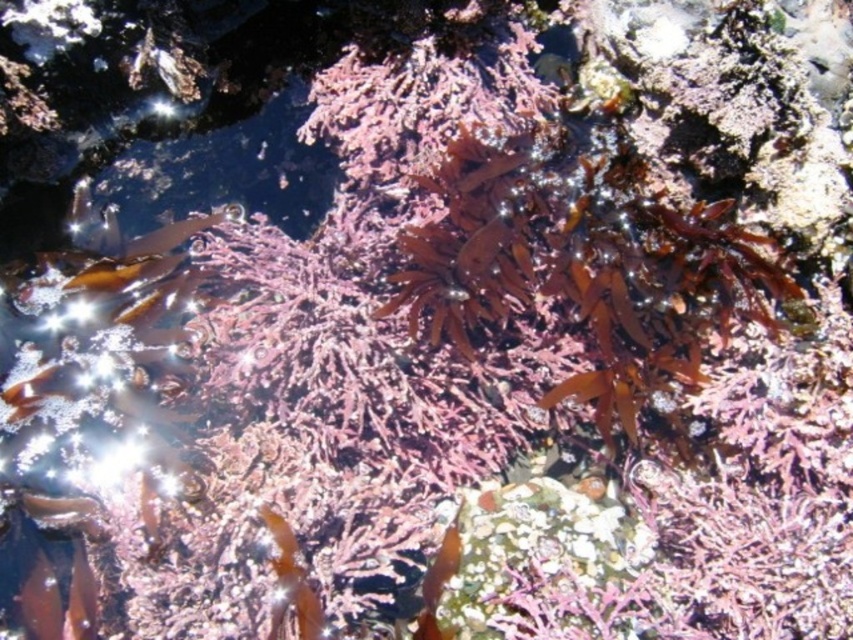
You are a scuba diver preparing to take a photo of the underwater scene. You want to focus on the point at coordinates point [45,588]. If your camera has a maximum focus range of 2 meters, will you be able to capture the point clearly?

The distance of point [45,588] from viewer is 1.94 meters, so yes, the camera can focus on the point since it is within the 2 meter range.

You are a marine biologist observing an underwater scene. You notice a shiny orange fish at bottom left and a translucent brown seaweed at lower left. Which object is bigger in size?

The shiny orange fish at bottom left is larger in size compared to the translucent brown seaweed at lower left.

You are a diver exploring the underwater scene. You see two points marked in the image. Which point is closer to you, point [33,589] or point [68,621]?

Point [33,589] is in front of point [68,621], so it is closer to you.